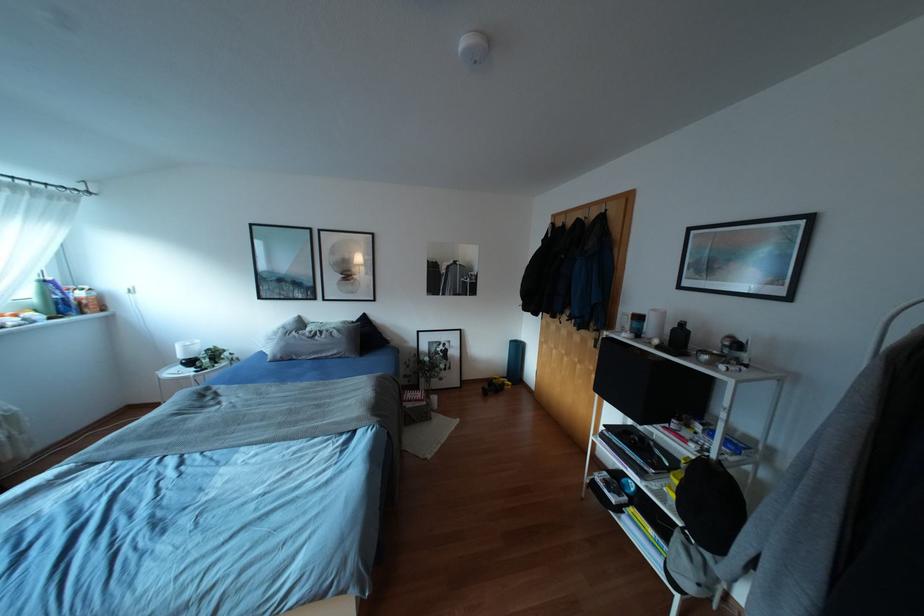
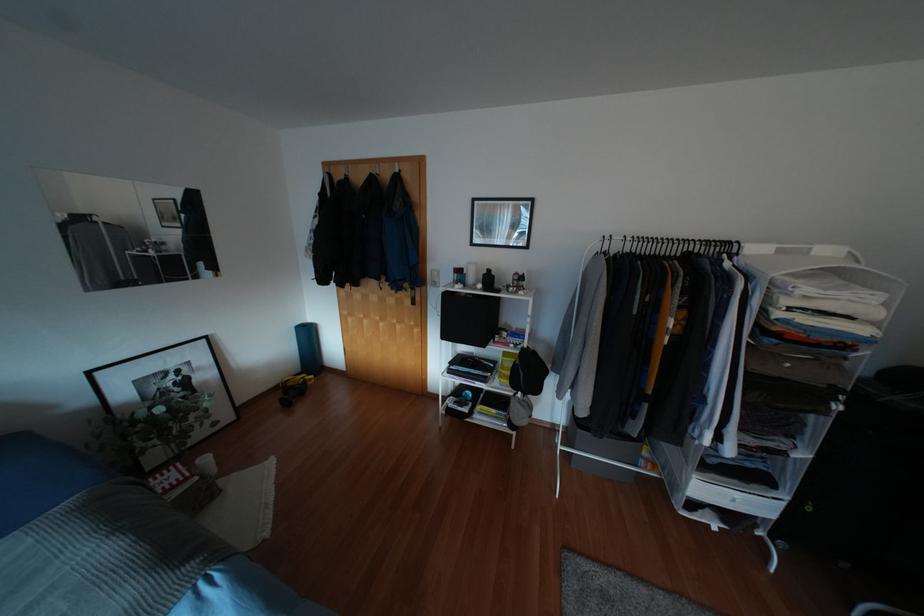
Where in the second image is the point corresponding to point 505,387 from the first image?

(309, 383)